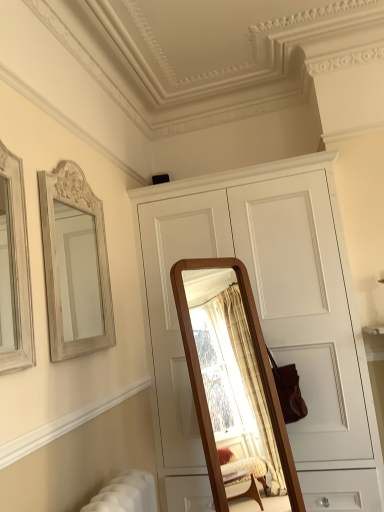
Question: Is white wood cabinet at center inside or outside of white carved wood mirror at upper left?

Choices:
 (A) inside
 (B) outside

Answer: (B)

Question: Is white wood cabinet at center wider or thinner than white carved wood mirror at upper left?

Choices:
 (A) wide
 (B) thin

Answer: (A)

Question: Estimate the real-world distances between objects in this image. Which object is farther from the white wood cabinet at center?

Choices:
 (A) white carved wood mirror at upper left
 (B) wooden frame mirror at left

Answer: (B)

Question: Considering the real-world distances, which object is closest to the wooden frame mirror at left?

Choices:
 (A) white wood cabinet at center
 (B) white carved wood mirror at upper left

Answer: (B)